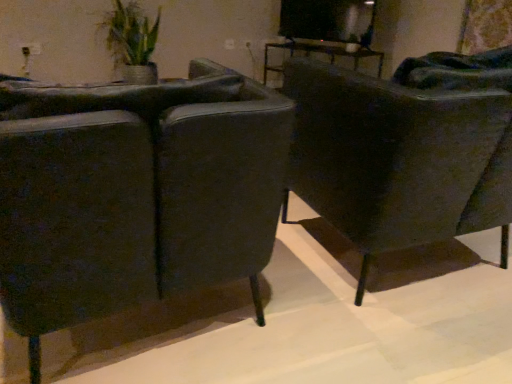
Locate an element on the screen. green woven basket at upper left is located at coordinates (132, 42).

Find the location of a particular element. The image size is (512, 384). matte black chair at right, the 1th chair when ordered from right to left is located at coordinates (398, 158).

Locate an element on the screen. green woven basket at upper left is located at coordinates (132, 42).

Considering the sizes of green woven basket at upper left and matte black chair at left, which is counted as the second chair, starting from the right, in the image, is green woven basket at upper left wider or thinner than matte black chair at left, which is counted as the second chair, starting from the right,?

Considering their sizes, green woven basket at upper left looks slimmer than matte black chair at left, which is counted as the second chair, starting from the right.

Does green woven basket at upper left have a lesser height compared to matte black chair at left, which is counted as the second chair, starting from the right?

Yes.

From the image's perspective, is green woven basket at upper left above or below matte black chair at left, the 1th chair viewed from the left?

From the image's perspective, green woven basket at upper left appears above matte black chair at left, the 1th chair viewed from the left.

From a real-world perspective, which object stands above the other?

green woven basket at upper left is physically above.

Does matte black chair at right, the second chair in the left-to-right sequence, have a lesser height compared to green woven basket at upper left?

In fact, matte black chair at right, the second chair in the left-to-right sequence, may be taller than green woven basket at upper left.

Which is more to the right, matte black chair at right, the second chair in the left-to-right sequence, or green woven basket at upper left?

matte black chair at right, the second chair in the left-to-right sequence.

From the image's perspective, which one is positioned higher, matte black chair at right, the second chair in the left-to-right sequence, or green woven basket at upper left?

green woven basket at upper left.

Considering the sizes of objects matte black chair at right, the 1th chair when ordered from right to left, and green woven basket at upper left in the image provided, who is thinner, matte black chair at right, the 1th chair when ordered from right to left, or green woven basket at upper left?

With smaller width is green woven basket at upper left.

Which object is closer to the camera taking this photo, green woven basket at upper left or matte black chair at right, the 1th chair when ordered from right to left?

Positioned in front is matte black chair at right, the 1th chair when ordered from right to left.

From the picture: Considering the sizes of objects green woven basket at upper left and matte black chair at right, the second chair in the left-to-right sequence, in the image provided, who is taller, green woven basket at upper left or matte black chair at right, the second chair in the left-to-right sequence,?

With more height is matte black chair at right, the second chair in the left-to-right sequence.

From a real-world perspective, is green woven basket at upper left located higher than matte black chair at right, the second chair in the left-to-right sequence?

Yes, from a real-world perspective, green woven basket at upper left is above matte black chair at right, the second chair in the left-to-right sequence.

Would you say green woven basket at upper left is a long distance from matte black chair at right, the 1th chair when ordered from right to left?

green woven basket at upper left is far away from matte black chair at right, the 1th chair when ordered from right to left.

Are matte black chair at right, the 1th chair when ordered from right to left, and matte black chair at left, the 1th chair viewed from the left, beside each other?

matte black chair at right, the 1th chair when ordered from right to left, and matte black chair at left, the 1th chair viewed from the left, are not in contact.

How different are the orientations of matte black chair at right, the 1th chair when ordered from right to left, and matte black chair at left, which is counted as the second chair, starting from the right, in degrees?

They differ by 0.000176 degrees in their facing directions.

Which object is positioned more to the right, matte black chair at right, the 1th chair when ordered from right to left, or matte black chair at left, which is counted as the second chair, starting from the right?

matte black chair at right, the 1th chair when ordered from right to left, is more to the right.

Based on the photo, which of these two, matte black chair at right, the 1th chair when ordered from right to left, or matte black chair at left, the 1th chair viewed from the left, stands taller?

Standing taller between the two is matte black chair at left, the 1th chair viewed from the left.

Would you consider matte black chair at left, which is counted as the second chair, starting from the right, to be distant from green woven basket at upper left?

Yes, matte black chair at left, which is counted as the second chair, starting from the right, and green woven basket at upper left are quite far apart.

Considering the positions of points (184, 206) and (153, 38), is point (184, 206) closer to camera compared to point (153, 38)?

Yes.

Looking at their sizes, would you say matte black chair at left, the 1th chair viewed from the left, is wider or thinner than green woven basket at upper left?

Clearly, matte black chair at left, the 1th chair viewed from the left, has more width compared to green woven basket at upper left.

From a real-world perspective, is matte black chair at left, which is counted as the second chair, starting from the right, positioned above or below green woven basket at upper left?

matte black chair at left, which is counted as the second chair, starting from the right, is situated lower than green woven basket at upper left in the real world.

Is point (61, 242) less distant than point (477, 126)?

Yes, point (61, 242) is in front of point (477, 126).

Is matte black chair at right, the 1th chair when ordered from right to left, inside matte black chair at left, which is counted as the second chair, starting from the right?

No.

Looking at the image, does matte black chair at left, the 1th chair viewed from the left, seem bigger or smaller compared to matte black chair at right, the 1th chair when ordered from right to left?

Considering their sizes, matte black chair at left, the 1th chair viewed from the left, takes up less space than matte black chair at right, the 1th chair when ordered from right to left.

The height and width of the screenshot is (384, 512). Find the location of `chair below the matte black chair at right, the second chair in the left-to-right sequence (from the image's perspective)`. chair below the matte black chair at right, the second chair in the left-to-right sequence (from the image's perspective) is located at coordinates (178, 188).

Where is `houseplant above the matte black chair at left, the 1th chair viewed from the left (from the image's perspective)`? houseplant above the matte black chair at left, the 1th chair viewed from the left (from the image's perspective) is located at coordinates (132, 42).

This screenshot has width=512, height=384. In order to click on houseplant that appears on the left of matte black chair at right, the second chair in the left-to-right sequence in this screenshot , I will do `click(132, 42)`.

From the image, which object appears to be farther from green woven basket at upper left, matte black chair at left, which is counted as the second chair, starting from the right, or matte black chair at right, the 1th chair when ordered from right to left?

Among the two, matte black chair at left, which is counted as the second chair, starting from the right, is located further to green woven basket at upper left.

When comparing their distances from matte black chair at right, the 1th chair when ordered from right to left, does matte black chair at left, which is counted as the second chair, starting from the right, or green woven basket at upper left seem closer?

matte black chair at left, which is counted as the second chair, starting from the right, is positioned closer to the anchor matte black chair at right, the 1th chair when ordered from right to left.

Estimate the real-world distances between objects in this image. Which object is further from matte black chair at right, the second chair in the left-to-right sequence, green woven basket at upper left or matte black chair at left, which is counted as the second chair, starting from the right?

green woven basket at upper left is further to matte black chair at right, the second chair in the left-to-right sequence.

Based on their spatial positions, is matte black chair at right, the 1th chair when ordered from right to left, or matte black chair at left, the 1th chair viewed from the left, closer to green woven basket at upper left?

matte black chair at right, the 1th chair when ordered from right to left, is closer to green woven basket at upper left.

Looking at the image, which one is located further to matte black chair at left, which is counted as the second chair, starting from the right, matte black chair at right, the 1th chair when ordered from right to left, or green woven basket at upper left?

The object further to matte black chair at left, which is counted as the second chair, starting from the right, is green woven basket at upper left.

Estimate the real-world distances between objects in this image. Which object is closer to matte black chair at left, which is counted as the second chair, starting from the right, green woven basket at upper left or matte black chair at right, the second chair in the left-to-right sequence?

matte black chair at right, the second chair in the left-to-right sequence.

You are a GUI agent. You are given a task and a screenshot of the screen. Output one action in this format:
    pyautogui.click(x=<x>, y=<y>)
    Task: Click on the chair between matte black chair at left, which is counted as the second chair, starting from the right, and green woven basket at upper left from front to back
    This screenshot has width=512, height=384.
    Given the screenshot: What is the action you would take?
    [398, 158]